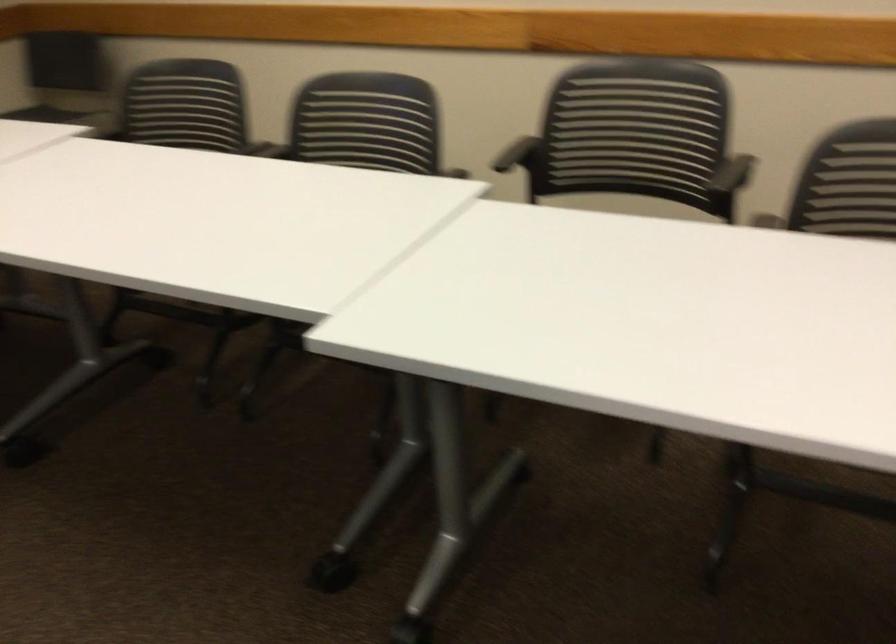
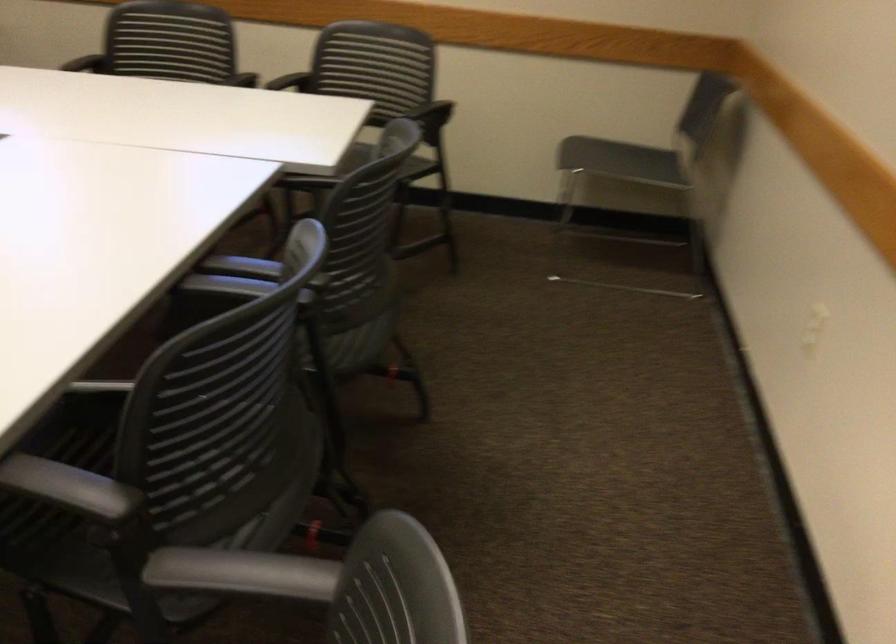
Find the pixel in the second image that matches pixel 231 165 in the first image.

(246, 274)